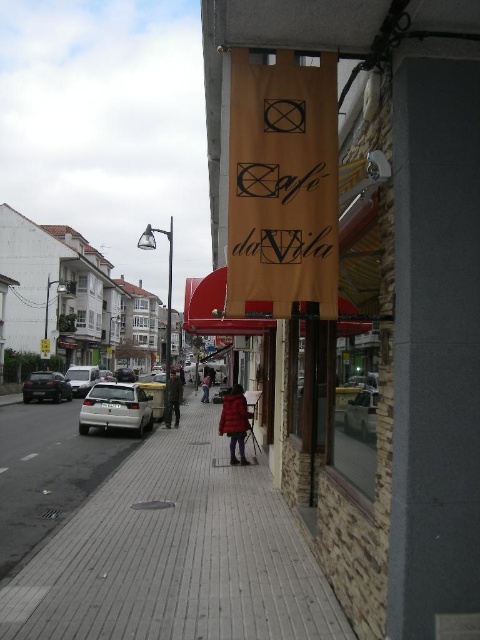
Question: Is orange fabric sign at upper center positioned before silver metallic sedan at center?

Choices:
 (A) no
 (B) yes

Answer: (B)

Question: Which object appears closest to the camera in this image?

Choices:
 (A) dark brown leather jacket at center
 (B) white matte car at lower left
 (C) red wool coat at center
 (D) smooth concrete pavement at center

Answer: (D)

Question: Estimate the real-world distances between objects in this image. Which object is closer to the smooth concrete pavement at center?

Choices:
 (A) orange fabric sign at upper center
 (B) silver metallic sedan at center
 (C) matte red coat at center

Answer: (A)

Question: Considering the real-world distances, which object is closest to the red wool coat at center?

Choices:
 (A) matte red coat at center
 (B) metallic silver car at center
 (C) dark brown leather jacket at center
 (D) silver metallic car at left

Answer: (D)

Question: Can you confirm if orange fabric sign at upper center is positioned below dark brown leather jacket at center?

Choices:
 (A) yes
 (B) no

Answer: (B)

Question: Can you confirm if white matte car at lower left is positioned to the left of matte red coat at center?

Choices:
 (A) yes
 (B) no

Answer: (A)